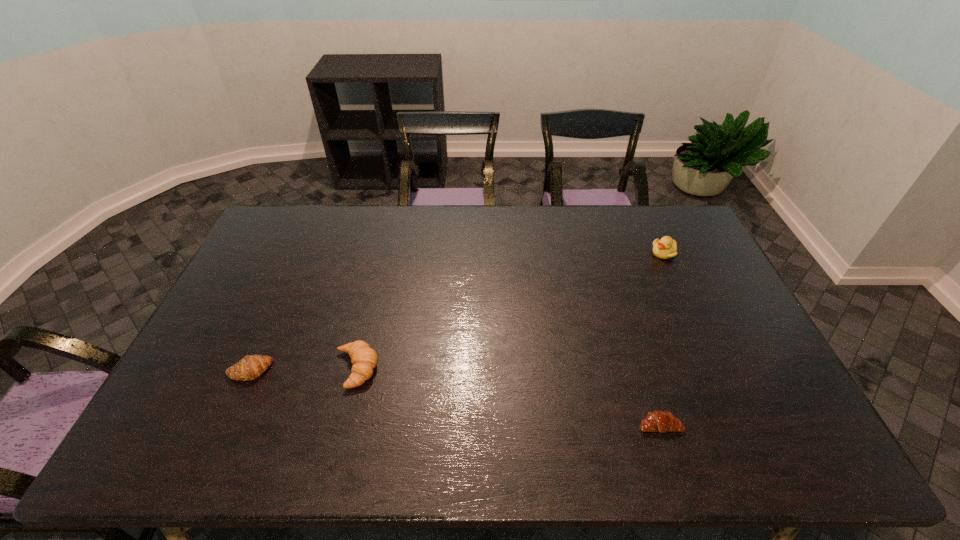
You are a GUI agent. You are given a task and a screenshot of the screen. Output one action in this format:
    pyautogui.click(x=<x>, y=<y>)
    Task: Click on the free space located on the beak of the duckling
    This screenshot has height=540, width=960.
    Given the screenshot: What is the action you would take?
    pyautogui.click(x=581, y=253)

Locate an element on the screen. free spot located on the left of the second crescent roll from left to right is located at coordinates (246, 369).

At what (x,y) coordinates should I click in order to perform the action: click on vacant area located on the right of the second shortest crescent roll. Please return your answer as a coordinate pair (x, y). The height and width of the screenshot is (540, 960). Looking at the image, I should click on (407, 371).

I want to click on vacant space located on the front of the third object from left to right, so click(669, 455).

This screenshot has width=960, height=540. Find the location of `object that is at the far edge`. object that is at the far edge is located at coordinates (665, 248).

Locate an element on the screen. Image resolution: width=960 pixels, height=540 pixels. object located at the near edge is located at coordinates (660, 421).

What are the coordinates of `object present at the left edge` in the screenshot? It's located at (252, 367).

Find the location of a particular element. This screenshot has height=540, width=960. object situated at the right edge is located at coordinates (665, 248).

The height and width of the screenshot is (540, 960). I want to click on object located at the far right corner, so click(665, 248).

At what (x,y) coordinates should I click in order to perform the action: click on blank area at the far edge. Please return your answer as a coordinate pair (x, y). Looking at the image, I should click on (616, 217).